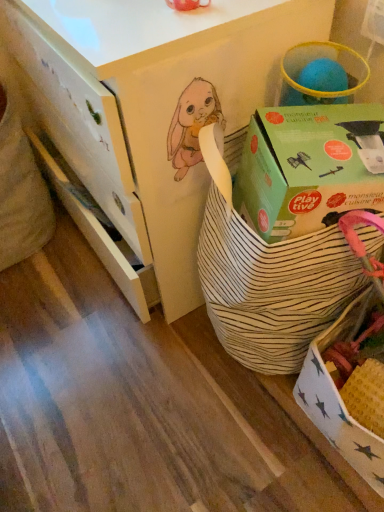
In order to face white striped fabric basket at center, should I rotate leftwards or rightwards?

A 13.111 degree turn to the right will do.

What is the approximate height of green cardboard box at upper right?

green cardboard box at upper right is 20.00 centimeters tall.

Where is `white striped basket at center`? The height and width of the screenshot is (512, 384). white striped basket at center is located at coordinates (155, 104).

Locate an element on the screen. desk that is above the green cardboard box at upper right (from the image's perspective) is located at coordinates (155, 104).

Is white striped basket at center placed right next to green cardboard box at upper right?

They are not placed beside each other.

Between white striped basket at center and green cardboard box at upper right, which one has less height?

Result: green cardboard box at upper right.

From a real-world perspective, which object stands above the other?

green cardboard box at upper right is physically above.

Does white striped fabric basket at center contain green cardboard box at upper right?

Yes, white striped fabric basket at center contains green cardboard box at upper right.

Is white striped fabric basket at center far from green cardboard box at upper right?

No, white striped fabric basket at center is in close proximity to green cardboard box at upper right.

Is white striped fabric basket at center facing away from green cardboard box at upper right?

No, white striped fabric basket at center's orientation is not away from green cardboard box at upper right.

Looking at the image, does white striped fabric basket at center seem bigger or smaller compared to green cardboard box at upper right?

Clearly, white striped fabric basket at center is larger in size than green cardboard box at upper right.

Consider the image. Which is more to the left, green cardboard box at upper right or white striped fabric basket at center?

green cardboard box at upper right.

Is green cardboard box at upper right placed right next to white striped fabric basket at center?

No.

From a real-world perspective, is green cardboard box at upper right under white striped fabric basket at center?

No, from a real-world perspective, green cardboard box at upper right is not under white striped fabric basket at center.

Who is more distant, green cardboard box at upper right or white striped fabric basket at center?

green cardboard box at upper right is further from the camera.

Find the location of a particular element. The height and width of the screenshot is (512, 384). box on the right of white striped basket at center is located at coordinates (307, 168).

Is white striped basket at center a part of green cardboard box at upper right?

No, green cardboard box at upper right does not contain white striped basket at center.

Looking at this image, considering the positions of objects green cardboard box at upper right and white striped basket at center in the image provided, who is behind, green cardboard box at upper right or white striped basket at center?

white striped basket at center is behind.

Between point (341, 131) and point (56, 111), which one is positioned in front?

The point (341, 131) is more forward.

Is white striped fabric basket at center taller than white striped basket at center?

Incorrect, the height of white striped fabric basket at center is not larger of that of white striped basket at center.

Is white striped fabric basket at center positioned in front of white striped basket at center?

Yes, white striped fabric basket at center is in front of white striped basket at center.

Where is `gift basket lying on the right of white striped basket at center`? This screenshot has height=512, width=384. gift basket lying on the right of white striped basket at center is located at coordinates (266, 274).

Considering the positions of point (255, 306) and point (199, 52), is point (255, 306) closer or farther from the camera than point (199, 52)?

Point (255, 306) appears to be farther away from the viewer than point (199, 52).

Considering the relative sizes of white striped basket at center and white striped fabric basket at center in the image provided, is white striped basket at center wider than white striped fabric basket at center?

Yes.

Is white striped basket at center positioned with its back to white striped fabric basket at center?

white striped basket at center is not turned away from white striped fabric basket at center.

What's the angular difference between white striped basket at center and white striped fabric basket at center's facing directions?

They differ by 0.00059 degrees in their facing directions.

Which is correct: white striped basket at center is inside white striped fabric basket at center, or outside of it?

white striped basket at center is located beyond the bounds of white striped fabric basket at center.

At what (x,y) coordinates should I click in order to perform the action: click on box that is above the white striped basket at center (from a real-world perspective). Please return your answer as a coordinate pair (x, y). Looking at the image, I should click on (307, 168).

At what (x,y) coordinates should I click in order to perform the action: click on box to the left of white striped fabric basket at center. Please return your answer as a coordinate pair (x, y). This screenshot has height=512, width=384. Looking at the image, I should click on (307, 168).

Which object lies nearer to the anchor point white striped fabric basket at center, white striped basket at center or green cardboard box at upper right?

green cardboard box at upper right.

Based on their spatial positions, is white striped basket at center or white striped fabric basket at center further from green cardboard box at upper right?

white striped basket at center.

Based on their spatial positions, is white striped fabric basket at center or white striped basket at center further from green cardboard box at upper right?

white striped basket at center is further to green cardboard box at upper right.

When comparing their distances from white striped fabric basket at center, does green cardboard box at upper right or white striped basket at center seem closer?

green cardboard box at upper right lies closer to white striped fabric basket at center than the other object.

When comparing their distances from white striped basket at center, does white striped fabric basket at center or green cardboard box at upper right seem closer?

white striped fabric basket at center.

From the image, which object appears to be nearer to white striped basket at center, green cardboard box at upper right or white striped fabric basket at center?

Based on the image, white striped fabric basket at center appears to be nearer to white striped basket at center.

Find the location of a particular element. box between white striped basket at center and white striped fabric basket at center is located at coordinates (307, 168).